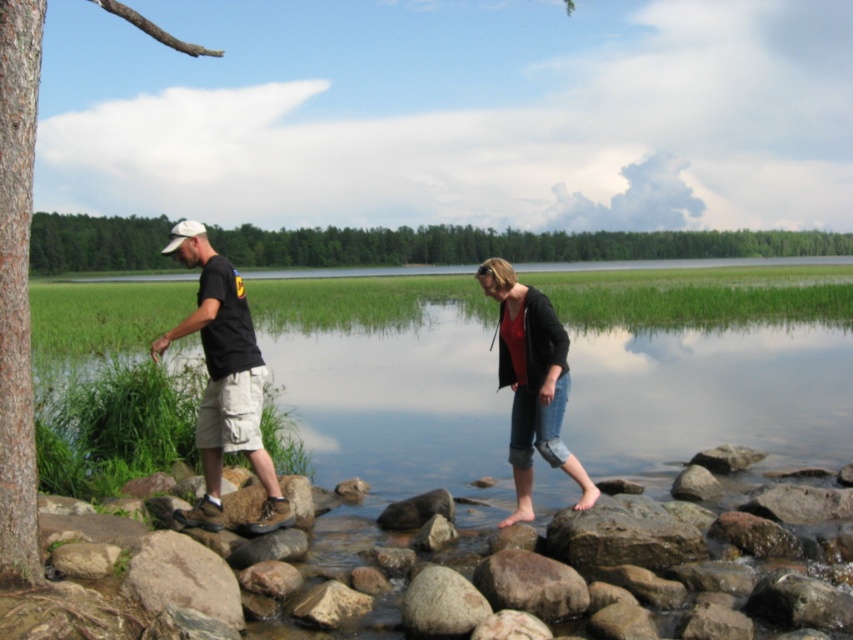
You are a hiker who wants to place a small backpack on the smooth gray rock at lower center. However, there is a smooth brown tree trunk at left nearby. Can you place the backpack on the rock without it being under the tree trunk?

The smooth brown tree trunk at left is located above the smooth gray rock at lower center, so placing the backpack on the smooth gray rock at lower center would mean it is under the tree trunk. Therefore, you cannot place the backpack there without it being under the tree trunk.

You are a photographer planning to take a picture of the smooth brown tree trunk at left and the smooth gray rock at lower center. Based on their positions, which object should you focus on first if you want to capture both in a single frame without moving the camera?

The smooth brown tree trunk at left is positioned on the left side of the smooth gray rock at lower center, so you should focus on the smooth brown tree trunk at left first to ensure both are in frame.